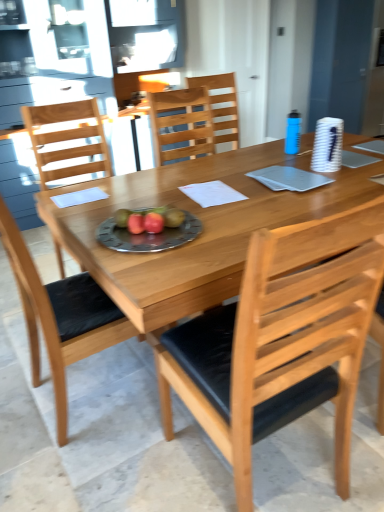
Question: Is light brown wood chair at center, placed as the 3th chair when sorted from front to back, facing away from red matte apple at center, arranged as the first fruit when viewed from the left?

Choices:
 (A) yes
 (B) no

Answer: (B)

Question: Does light brown wood chair at center, placed as the 3th chair when sorted from front to back, appear on the left side of red matte apple at center, placed as the second fruit when sorted from right to left?

Choices:
 (A) no
 (B) yes

Answer: (B)

Question: Is light brown wood chair at center, placed as the 3th chair when sorted from front to back, positioned before red matte apple at center, arranged as the first fruit when viewed from the left?

Choices:
 (A) yes
 (B) no

Answer: (B)

Question: Is light brown wood chair at center, which appears as the 2th chair when viewed from the back, positioned behind red matte apple at center, placed as the second fruit when sorted from right to left?

Choices:
 (A) no
 (B) yes

Answer: (B)

Question: From a real-world perspective, is light brown wood chair at center, placed as the 3th chair when sorted from front to back, beneath red matte apple at center, arranged as the first fruit when viewed from the left?

Choices:
 (A) no
 (B) yes

Answer: (B)

Question: Is natural wood table at center in front of or behind metallic silver plate with fruits at center in the image?

Choices:
 (A) front
 (B) behind

Answer: (A)

Question: Looking at the image, does natural wood table at center seem bigger or smaller compared to metallic silver plate with fruits at center?

Choices:
 (A) small
 (B) big

Answer: (B)

Question: Considering the relative positions of natural wood table at center and metallic silver plate with fruits at center in the image provided, is natural wood table at center to the left or to the right of metallic silver plate with fruits at center?

Choices:
 (A) right
 (B) left

Answer: (A)

Question: From the image's perspective, is natural wood table at center positioned above or below metallic silver plate with fruits at center?

Choices:
 (A) above
 (B) below

Answer: (B)

Question: From the image's perspective, relative to wooden chair at center, which appears as the 1th chair when viewed from the back, is red matte apple at center, which is the 2th fruit in left-to-right order, above or below?

Choices:
 (A) below
 (B) above

Answer: (A)

Question: Is point (152, 224) positioned closer to the camera than point (231, 105)?

Choices:
 (A) farther
 (B) closer

Answer: (B)

Question: From a real-world perspective, is red matte apple at center, placed as the 1th fruit when sorted from right to left, physically located above or below wooden chair at center, arranged as the fourth chair when viewed from the front?

Choices:
 (A) below
 (B) above

Answer: (A)

Question: Which is correct: red matte apple at center, which is the 2th fruit in left-to-right order, is inside wooden chair at center, arranged as the fourth chair when viewed from the front, or outside of it?

Choices:
 (A) outside
 (B) inside

Answer: (A)

Question: Looking at the image, does metallic silver plate with fruits at center seem bigger or smaller compared to natural wood table at center?

Choices:
 (A) small
 (B) big

Answer: (A)

Question: From a real-world perspective, is metallic silver plate with fruits at center above or below natural wood table at center?

Choices:
 (A) below
 (B) above

Answer: (B)